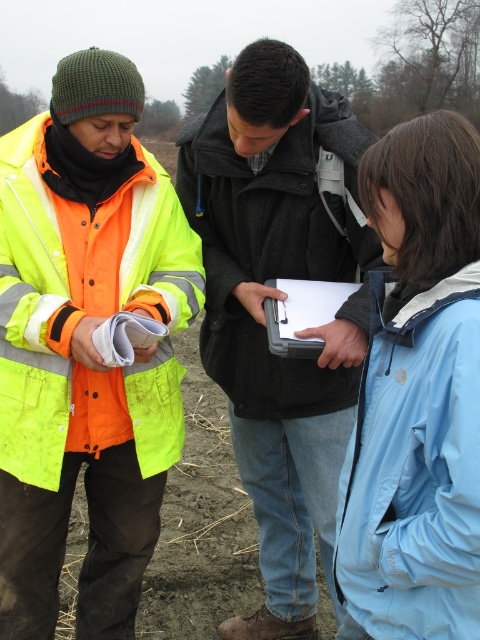
You are a field inspector trying to locate your equipment. You remember that your blue softshell jacket at center is positioned relative to your black plastic clipboard at center. Can you recall its exact location?

The blue softshell jacket at center is to the right of the black plastic clipboard at center.